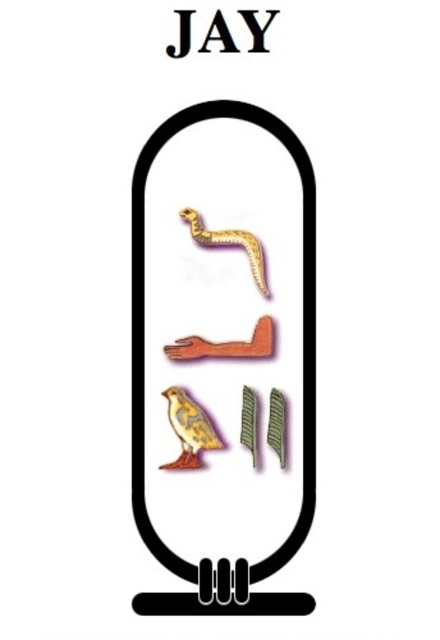
Does golden hieroglyphic snake at center lie in front of black plastic y at upper center?

No, golden hieroglyphic snake at center is further to the viewer.

Which is behind, point (286, 604) or point (252, 36)?

Positioned behind is point (286, 604).

Is point (314, 480) positioned in front of point (260, 44)?

No, it is not.

Locate an element on the screen. The width and height of the screenshot is (440, 640). golden hieroglyphic snake at center is located at coordinates (x=303, y=328).

Between golden hieroglyphic snake at center and black matte letter at upper center, which one is positioned higher?

black matte letter at upper center

Does point (289, 593) come farther from viewer compared to point (231, 40)?

Yes.

The height and width of the screenshot is (640, 440). What do you see at coordinates (303, 328) in the screenshot?
I see `golden hieroglyphic snake at center` at bounding box center [303, 328].

Locate an element on the screen. This screenshot has height=640, width=440. golden hieroglyphic snake at center is located at coordinates (303, 328).

How far apart are gold metallic snake at center and black paper jay at upper center?

gold metallic snake at center and black paper jay at upper center are 12.87 inches apart.

Looking at this image, can you confirm if gold metallic snake at center is positioned to the right of black paper jay at upper center?

Correct, you'll find gold metallic snake at center to the right of black paper jay at upper center.

What do you see at coordinates (230, 244) in the screenshot? The width and height of the screenshot is (440, 640). I see `gold metallic snake at center` at bounding box center [230, 244].

I want to click on gold metallic snake at center, so 230,244.